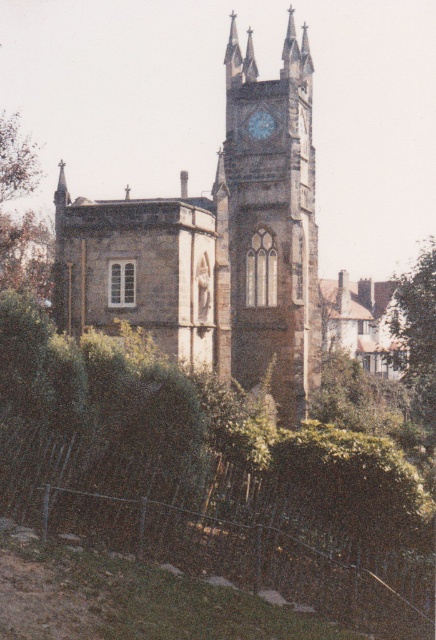
You are standing in front of the historic stone church and want to take a photo that includes both the green leafy tree at upper right and the metallic clock face at upper center. Given that your camera has a maximum zoom range of 25 meters, will you be able to capture both objects in the same frame without moving closer?

The green leafy tree at upper right is 30.89 meters away from the metallic clock face at upper center. Since your camera can only zoom up to 25 meters, you won t be able to capture both objects in the same frame without moving closer.

You are a photographer planning to take a picture of the stone clock tower at center and the green leafy tree at upper right. You want to ensure both are fully visible in the frame. Based on their sizes, which object might require you to adjust your camera angle to avoid cropping?

The stone clock tower at center might be wider than the green leafy tree at upper right, so you might need to adjust your camera angle to ensure the entire stone clock tower at center fits without cropping.

You are standing in front of the historic stone church and want to take a photo that includes both the stone clock tower at center and the green leafy tree at upper right. Which one should you adjust your camera angle to focus on first to ensure both are in frame?

The stone clock tower at center is above the green leafy tree at upper right, so you should focus on the stone clock tower at center first to ensure both are in frame.